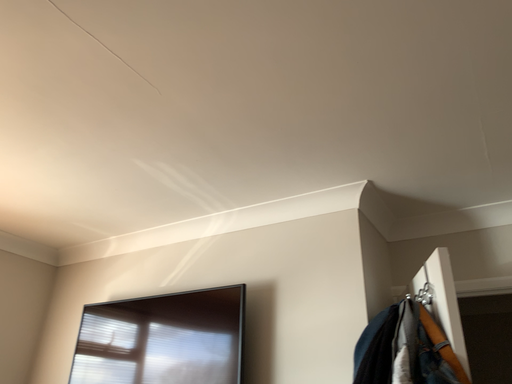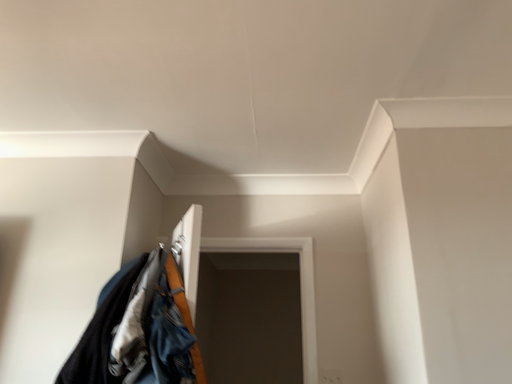
Question: How did the camera likely rotate when shooting the video?

Choices:
 (A) rotated right
 (B) rotated left

Answer: (A)